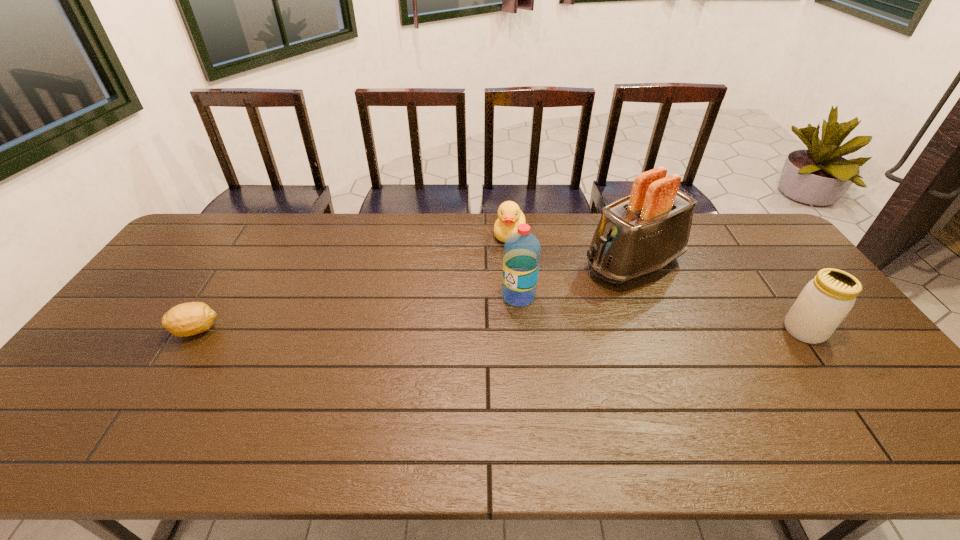
You are a GUI agent. You are given a task and a screenshot of the screen. Output one action in this format:
    pyautogui.click(x=<x>, y=<y>)
    Task: Click on the vacant space on the desktop that is between the lemon and the jar and is positioned at the beak of the duck
    Image resolution: width=960 pixels, height=540 pixels.
    Given the screenshot: What is the action you would take?
    pyautogui.click(x=460, y=330)

Image resolution: width=960 pixels, height=540 pixels. Identify the location of free space on the desktop that is between the shortest object and the third shortest object and is positioned on the front label of the water bottle. (464, 330).

Where is `free spot on the desktop that is between the lemon and the third shortest object and is positioned on the side of the second object from right to left with the control lever`? The width and height of the screenshot is (960, 540). free spot on the desktop that is between the lemon and the third shortest object and is positioned on the side of the second object from right to left with the control lever is located at coordinates (489, 330).